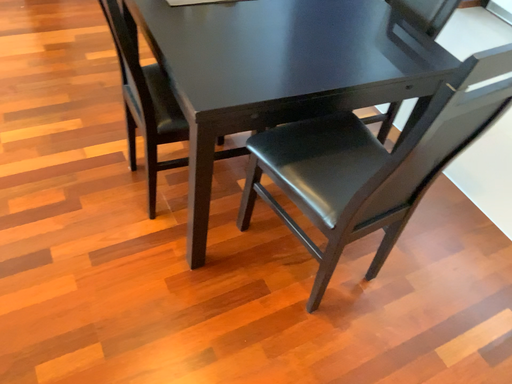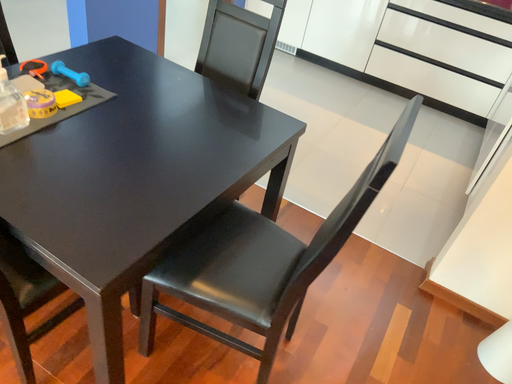
Question: Which way did the camera rotate in the video?

Choices:
 (A) rotated downward
 (B) rotated upward

Answer: (B)